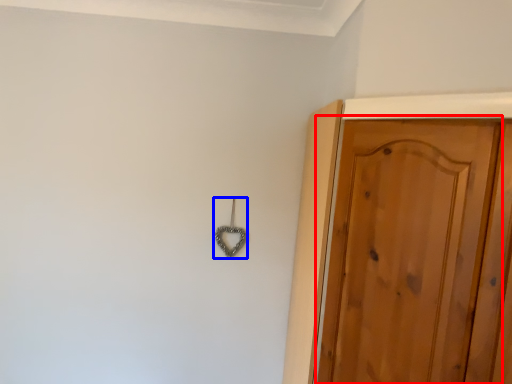
Question: Among these objects, which one is farthest to the camera, door (highlighted by a red box) or hook (highlighted by a blue box)?

Choices:
 (A) door
 (B) hook

Answer: (B)